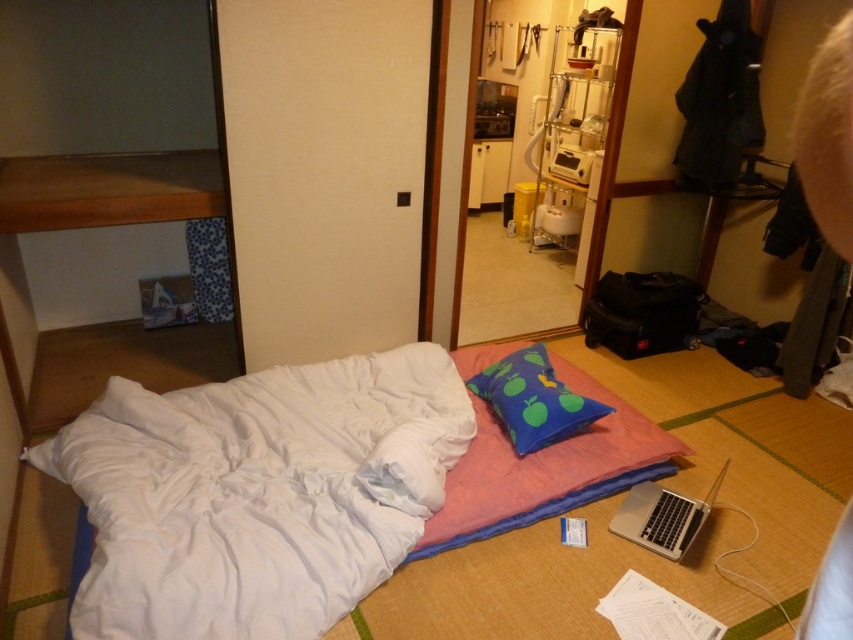
Question: Considering the real-world distances, which object is farthest from the pink fabric at center?

Choices:
 (A) blue fabric pillow at center
 (B) white soft bed at center

Answer: (B)

Question: Which point is closer to the camera?

Choices:
 (A) blue fabric pillow at center
 (B) pink fabric at center

Answer: (B)

Question: Does pink fabric at center have a smaller size compared to silver metallic laptop at lower right?

Choices:
 (A) no
 (B) yes

Answer: (A)

Question: Is pink fabric at center to the left of blue fabric pillow at center from the viewer's perspective?

Choices:
 (A) yes
 (B) no

Answer: (B)

Question: Which is nearer to the silver metallic laptop at lower right?

Choices:
 (A) blue fabric pillow at center
 (B) pink fabric at center

Answer: (B)

Question: Is white soft bed at center to the left of pink fabric at center from the viewer's perspective?

Choices:
 (A) yes
 (B) no

Answer: (A)